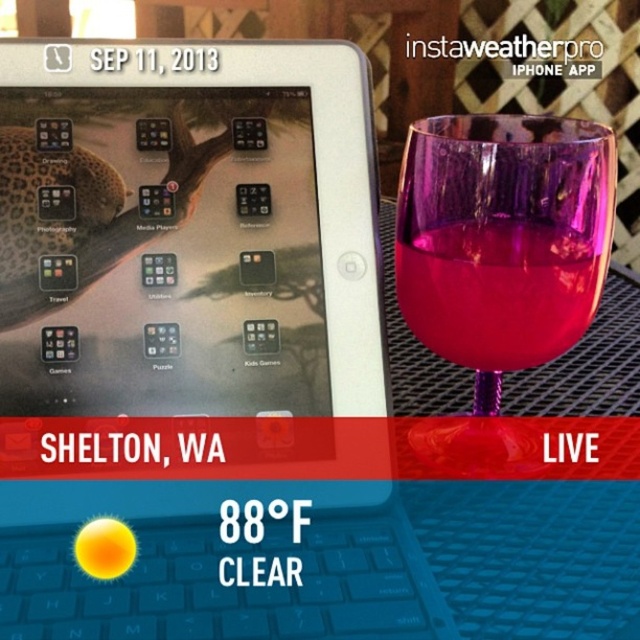
You are holding a small remote control that you need to place on either the satin silver laptop at center or the transparent glass at right. Considering their positions, which surface is easier to reach without moving your current position?

The satin silver laptop at center is closer to the viewer than the transparent glass at right, so it is easier to reach without moving your current position.

You are at a party and need to pour a drink. There are two glasses on the table next to you, a transparent purple wine glass at right and a transparent glass at right. Which glass is closer to you?

The transparent purple wine glass at right is closer to you because it is in front of the transparent glass at right.